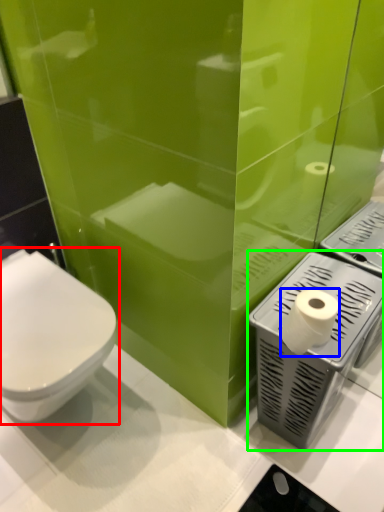
Question: Which object is the closest to the toilet (highlighted by a red box)? Choose among these: toilet paper (highlighted by a blue box) or appliance (highlighted by a green box).

Choices:
 (A) toilet paper
 (B) appliance

Answer: (B)